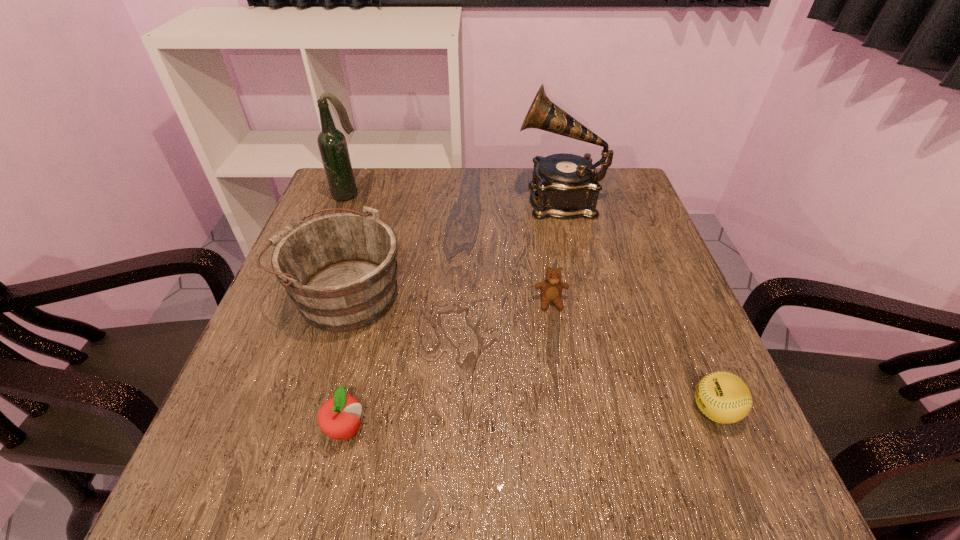
In order to click on vacant space in between the apple and the wine bucket in this screenshot , I will do `click(345, 361)`.

Locate an element on the screen. The height and width of the screenshot is (540, 960). vacant area between the beer bottle and the phonograph record is located at coordinates (454, 197).

Identify the location of vacant area that lies between the teddy bear and the rightmost object. (633, 356).

The width and height of the screenshot is (960, 540). Identify the location of free space between the phonograph record and the fourth shortest object. (451, 246).

This screenshot has height=540, width=960. Identify the location of object that is the fourth closest one to the teddy bear. (339, 417).

Locate which object ranks fourth in proximity to the beer bottle. Please provide its 2D coordinates. Your answer should be formatted as a tuple, i.e. [(x, y)], where the tuple contains the x and y coordinates of a point satisfying the conditions above.

[(339, 417)]

Image resolution: width=960 pixels, height=540 pixels. I want to click on vacant space that satisfies the following two spatial constraints: 1. on the horn of the phonograph record; 2. at the face of the teddy bear, so click(583, 302).

You are a GUI agent. You are given a task and a screenshot of the screen. Output one action in this format:
    pyautogui.click(x=<x>, y=<y>)
    Task: Click on the free spot that satisfies the following two spatial constraints: 1. on the horn of the phonograph record; 2. at the face of the teddy bear
    The width and height of the screenshot is (960, 540).
    Given the screenshot: What is the action you would take?
    pyautogui.click(x=583, y=302)

Identify the location of free spot that satisfies the following two spatial constraints: 1. on the horn of the phonograph record; 2. at the face of the teddy bear. (583, 302).

The image size is (960, 540). Find the location of `free space that satisfies the following two spatial constraints: 1. on the horn of the phonograph record; 2. at the face of the teddy bear`. free space that satisfies the following two spatial constraints: 1. on the horn of the phonograph record; 2. at the face of the teddy bear is located at coordinates [x=583, y=302].